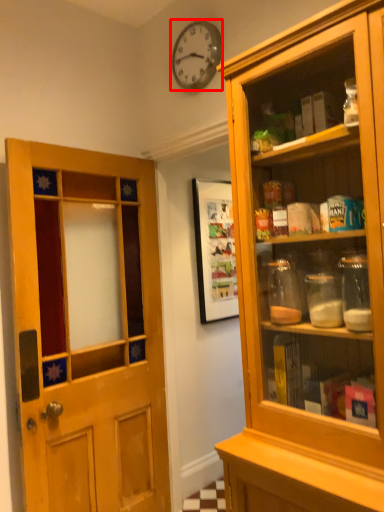
Question: From the image's perspective, where is clock (annotated by the red box) located relative to door?

Choices:
 (A) below
 (B) above

Answer: (B)